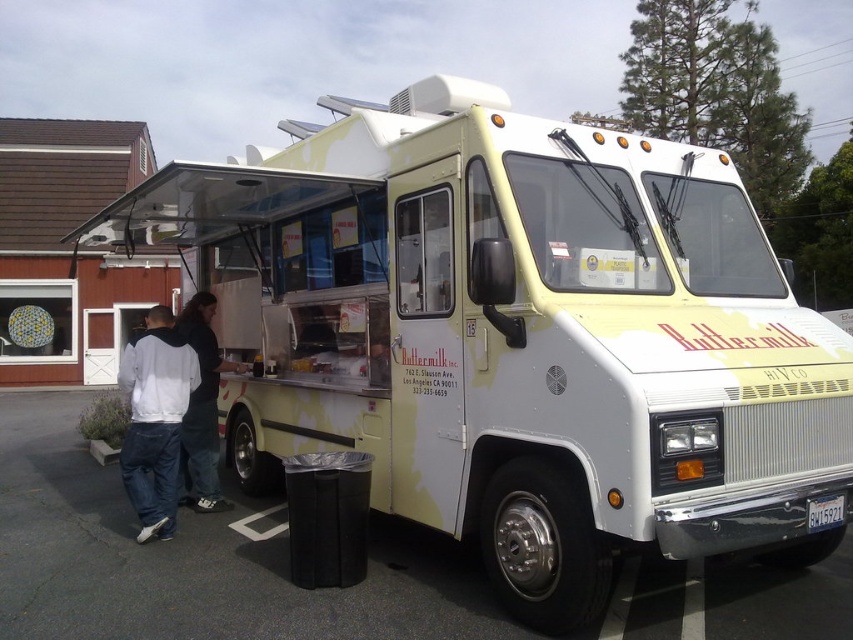
Who is shorter, white asphalt at lower left or white hoodie at left?

With less height is white asphalt at lower left.

The image size is (853, 640). Find the location of `white asphalt at lower left`. white asphalt at lower left is located at coordinates (198, 560).

Between white asphalt at lower left and white cotton shirt at left, which one appears on the left side from the viewer's perspective?

white asphalt at lower left is more to the left.

Is white asphalt at lower left smaller than white cotton shirt at left?

No.

Describe the element at coordinates (198, 560) in the screenshot. I see `white asphalt at lower left` at that location.

Identify the location of white asphalt at lower left. The height and width of the screenshot is (640, 853). (198, 560).

Can you confirm if white hoodie at left is positioned to the right of white cotton shirt at left?

In fact, white hoodie at left is to the left of white cotton shirt at left.

At what (x,y) coordinates should I click in order to perform the action: click on white hoodie at left. Please return your answer as a coordinate pair (x, y). This screenshot has height=640, width=853. Looking at the image, I should click on (155, 419).

At what (x,y) coordinates should I click in order to perform the action: click on white hoodie at left. Please return your answer as a coordinate pair (x, y). Looking at the image, I should click on (155, 419).